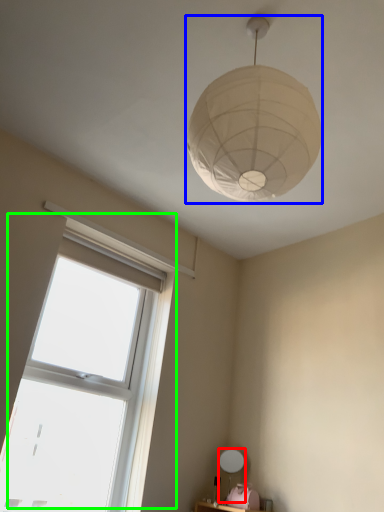
Question: Which object is the farthest from table lamp (highlighted by a red box)? Choose among these: lamp (highlighted by a blue box) or window (highlighted by a green box).

Choices:
 (A) lamp
 (B) window

Answer: (A)